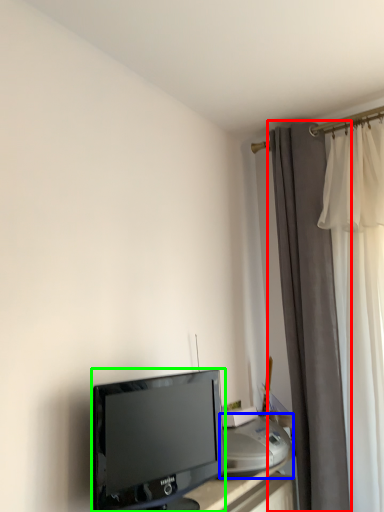
Question: Based on their relative distances, which object is nearer to curtain (highlighted by a red box)? Choose from printer (highlighted by a blue box) and television (highlighted by a green box).

Choices:
 (A) printer
 (B) television

Answer: (A)